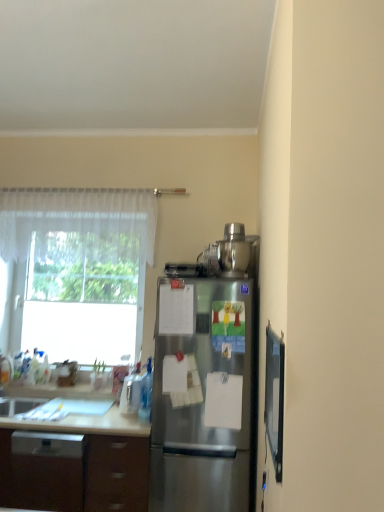
Where is `vacant area in front of clear plastic container at lower left, which is the 2th appliance from right to left`? The image size is (384, 512). vacant area in front of clear plastic container at lower left, which is the 2th appliance from right to left is located at coordinates (122, 421).